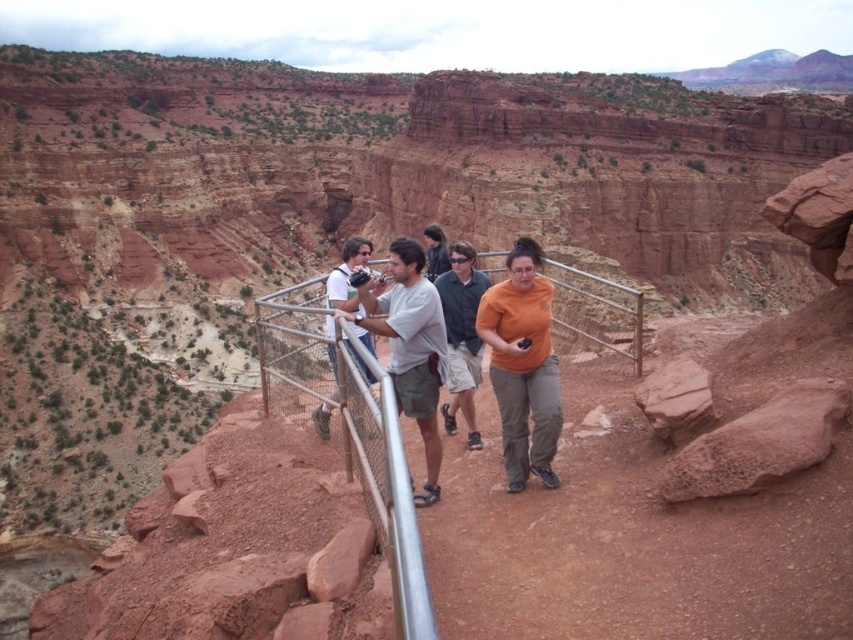
You are a photographer holding a camera with a 12 cm wide lens. You want to take a photo of the orange matte shirt at center without the silver metallic rail at center blocking the view. Is there enough space between them for the lens to fit?

The silver metallic rail at center might be wider than the orange matte shirt at center, so there may not be enough space between them for the 12 cm wide lens to fit without obstruction. Check the actual width difference to confirm.

You are standing on the elevated pathway and want to lean against the silver metallic rail at center. However, you are wearing a jacket with a hood that extends 1 meter above your head. Will the orange cotton shirt at center interfere with your hood when you lean against the rail?

The silver metallic rail at center is shorter than the orange cotton shirt at center, meaning the orange cotton shirt at center is taller. Since your hood extends 1 meter above your head, the taller orange cotton shirt at center may interfere with your hood when leaning against the rail.